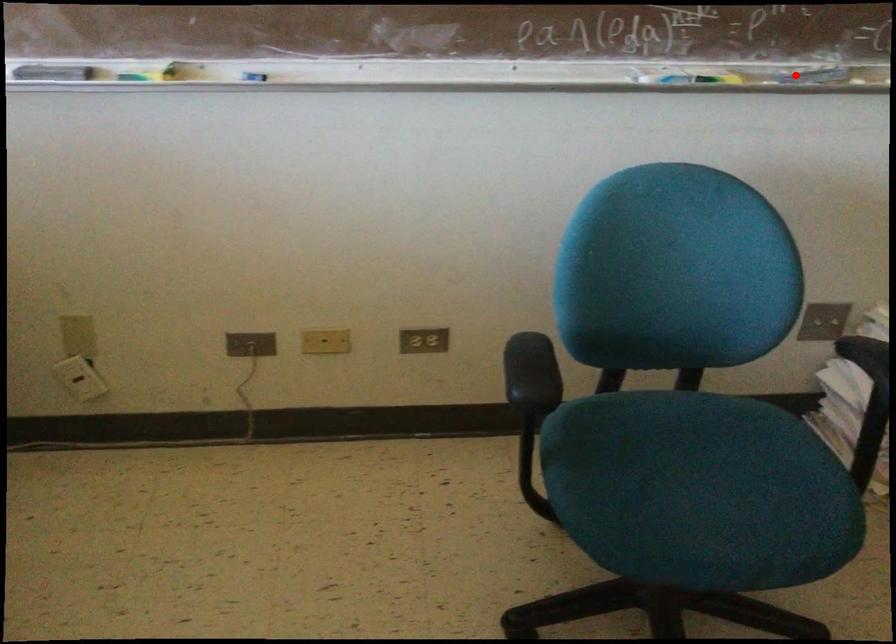
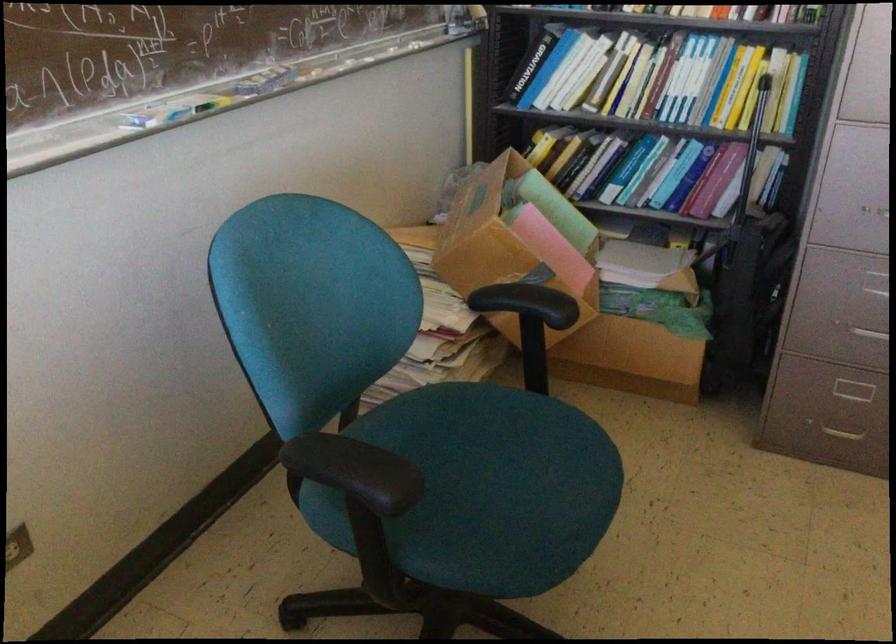
In the second image, find the point that corresponds to the highlighted location in the first image.

(264, 80)